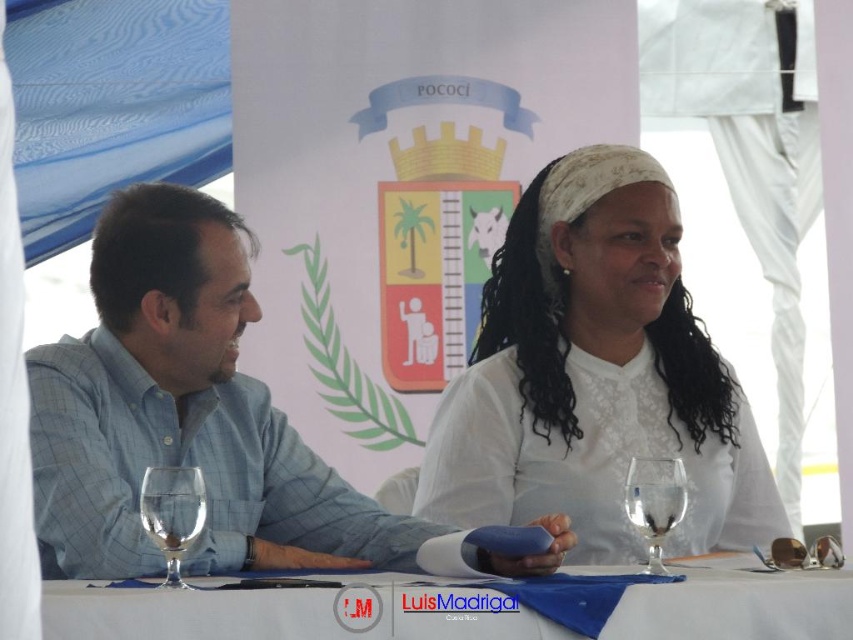
Question: Can you confirm if white lace blouse at center is wider than transparent glass wine glass at lower center?

Choices:
 (A) yes
 (B) no

Answer: (A)

Question: Can you confirm if blue plaid shirt at left is positioned above transparent glass wine glass at lower center?

Choices:
 (A) no
 (B) yes

Answer: (B)

Question: Which object is closer to the camera taking this photo?

Choices:
 (A) white cloth at center
 (B) white lace blouse at center

Answer: (A)

Question: Which object appears farthest from the camera in this image?

Choices:
 (A) transparent glass wine glass at lower center
 (B) white lace blouse at center
 (C) white cloth at center
 (D) transparent glass at center

Answer: (B)

Question: Can you confirm if transparent glass wine glass at lower center is positioned above transparent glass at center?

Choices:
 (A) no
 (B) yes

Answer: (B)

Question: Among these points, which one is farthest from the camera?

Choices:
 (A) (169, 499)
 (B) (140, 211)
 (C) (178, 627)

Answer: (B)